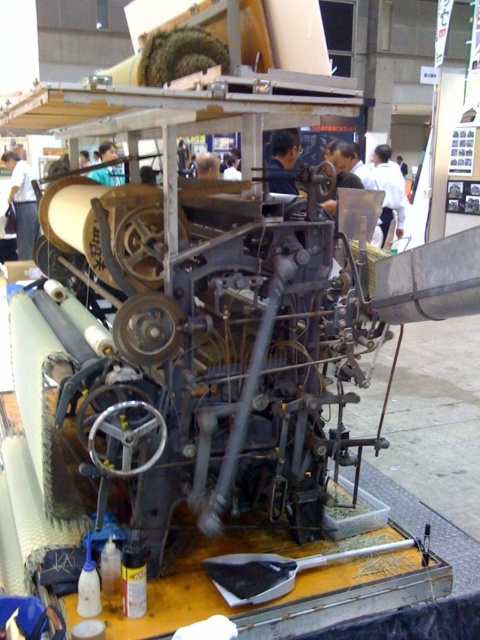
Question: Which point is closer to the camera?

Choices:
 (A) white shirt at left
 (B) white fabric at center

Answer: (B)

Question: Estimate the real-world distances between objects in this image. Which object is farther from the dark brown hair at center?

Choices:
 (A) dark blue shirt at center
 (B) white shirt at left
 (C) white fabric at center
 (D) blue fabric at center

Answer: (B)

Question: Which point is farther from the camera taking this photo?

Choices:
 (A) (207, 168)
 (B) (384, 202)
 (C) (27, 198)
 (D) (276, 189)

Answer: (C)

Question: Does dark blue shirt at center lie behind dark brown hair at center?

Choices:
 (A) yes
 (B) no

Answer: (B)

Question: Does white shirt at left have a smaller size compared to white fabric at center?

Choices:
 (A) no
 (B) yes

Answer: (A)

Question: Does white shirt at left appear on the left side of blue fabric at center?

Choices:
 (A) yes
 (B) no

Answer: (A)